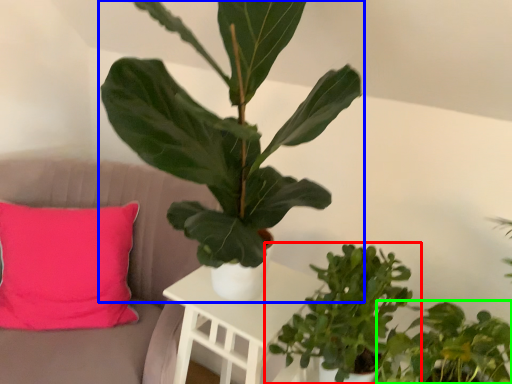
Question: Estimate the real-world distances between objects in this image. Which object is closer to houseplant (highlighted by a red box), houseplant (highlighted by a blue box) or houseplant (highlighted by a green box)?

Choices:
 (A) houseplant
 (B) houseplant

Answer: (B)